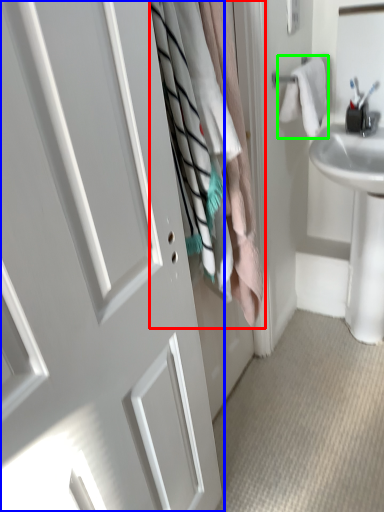
Question: Which object is positioned closest to laundry (highlighted by a red box)? Select from door (highlighted by a blue box) and bath towel (highlighted by a green box).

Choices:
 (A) door
 (B) bath towel

Answer: (A)